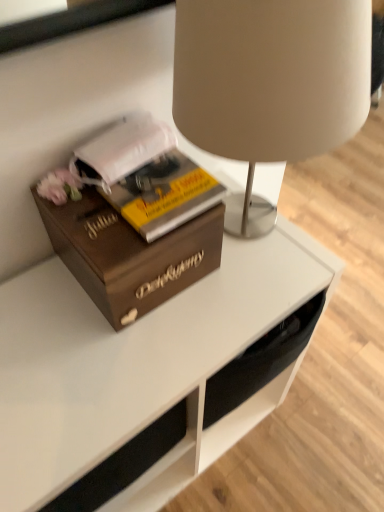
Locate an element on the screen. The height and width of the screenshot is (512, 384). spots to the right of wooden box at left is located at coordinates [x=239, y=300].